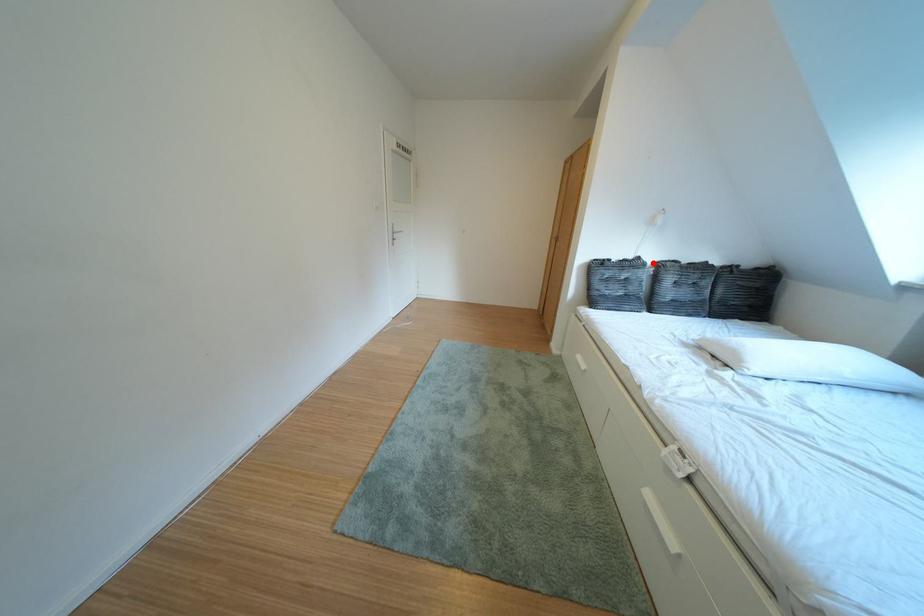
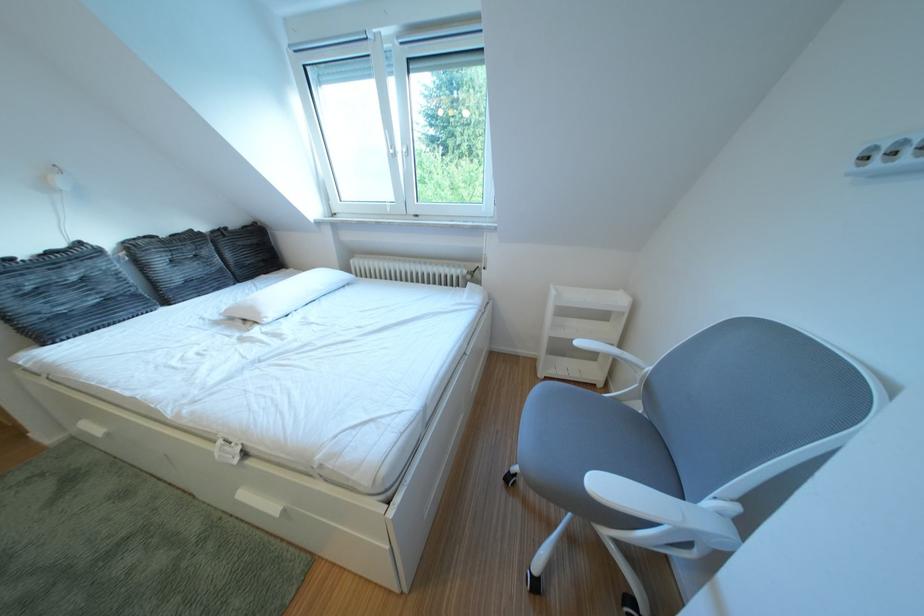
Question: I am providing you with two images of the same scene from different viewpoints. Image1 has a red point marked. In image2, the corresponding 3D location appears at what relative position? Reply with the corresponding letter.

Choices:
 (A) Closer
 (B) Farther

Answer: (B)